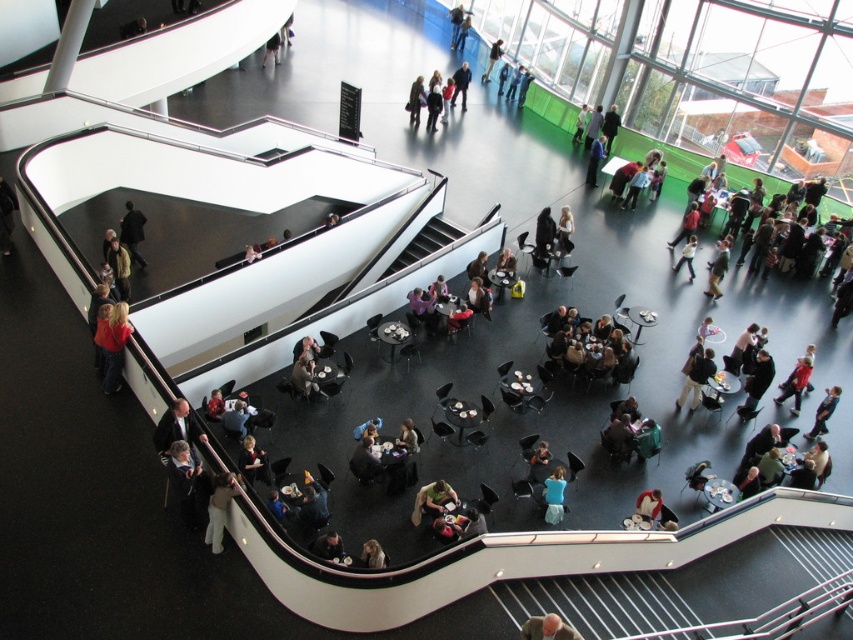
Which is more to the right, dark brown leather chairs at center or light brown hair at lower center?

From the viewer's perspective, dark brown leather chairs at center appears more on the right side.

The width and height of the screenshot is (853, 640). What do you see at coordinates (589, 346) in the screenshot? I see `dark brown leather chairs at center` at bounding box center [589, 346].

Where is `dark brown leather chairs at center`? The height and width of the screenshot is (640, 853). dark brown leather chairs at center is located at coordinates (589, 346).

Between green fabric jacket at center and blue fabric shirt at center, which one has more height?

blue fabric shirt at center

Who is shorter, green fabric jacket at center or blue fabric shirt at center?

Standing shorter between the two is green fabric jacket at center.

Does point (450, 486) come in front of point (548, 484)?

No, it is behind (548, 484).

Locate an element on the screen. This screenshot has height=640, width=853. green fabric jacket at center is located at coordinates (433, 500).

Is the position of light beige pants at lower left more distant than that of light brown leather jacket at center?

That is False.

Which is behind, point (219, 477) or point (418, 83)?

Point (418, 83)

This screenshot has height=640, width=853. I want to click on light beige pants at lower left, so click(219, 508).

Locate an element on the screen. This screenshot has width=853, height=640. light beige pants at lower left is located at coordinates (219, 508).